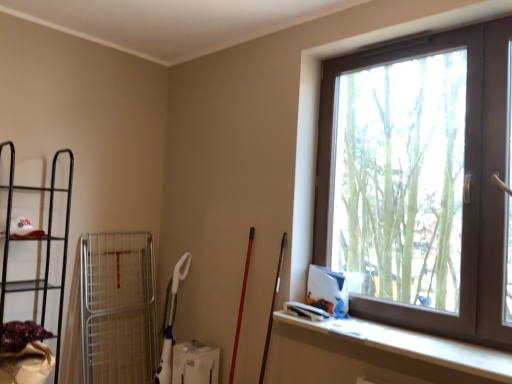
Question: Are white matte ledge at lower right and black metal shelf at left located far from each other?

Choices:
 (A) no
 (B) yes

Answer: (B)

Question: From the image's perspective, is white matte ledge at lower right on top of black metal shelf at left?

Choices:
 (A) yes
 (B) no

Answer: (B)

Question: Is white matte ledge at lower right not within black metal shelf at left?

Choices:
 (A) no
 (B) yes

Answer: (B)

Question: From a real-world perspective, is white matte ledge at lower right physically below black metal shelf at left?

Choices:
 (A) yes
 (B) no

Answer: (A)

Question: From the image's perspective, is white matte ledge at lower right beneath black metal shelf at left?

Choices:
 (A) no
 (B) yes

Answer: (B)

Question: Considering the positions of brown plastic window at upper right and white matte ledge at lower right in the image, is brown plastic window at upper right taller or shorter than white matte ledge at lower right?

Choices:
 (A) tall
 (B) short

Answer: (A)

Question: From the image's perspective, is brown plastic window at upper right above or below white matte ledge at lower right?

Choices:
 (A) below
 (B) above

Answer: (B)

Question: Is brown plastic window at upper right wider or thinner than white matte ledge at lower right?

Choices:
 (A) thin
 (B) wide

Answer: (A)

Question: Based on their sizes in the image, would you say brown plastic window at upper right is bigger or smaller than white matte ledge at lower right?

Choices:
 (A) big
 (B) small

Answer: (A)

Question: Based on their positions, is white matte ledge at lower right located to the left or right of brown plastic window at upper right?

Choices:
 (A) right
 (B) left

Answer: (B)

Question: Does point (309, 332) appear closer or farther from the camera than point (330, 77)?

Choices:
 (A) closer
 (B) farther

Answer: (A)

Question: Considering their positions, is white matte ledge at lower right located in front of or behind brown plastic window at upper right?

Choices:
 (A) front
 (B) behind

Answer: (A)

Question: From the image's perspective, is white matte ledge at lower right above or below brown plastic window at upper right?

Choices:
 (A) above
 (B) below

Answer: (B)

Question: From the image's perspective, is black metal shelf at left positioned above or below white matte ledge at lower right?

Choices:
 (A) below
 (B) above

Answer: (B)

Question: Considering the positions of black metal shelf at left and white matte ledge at lower right in the image, is black metal shelf at left taller or shorter than white matte ledge at lower right?

Choices:
 (A) tall
 (B) short

Answer: (A)